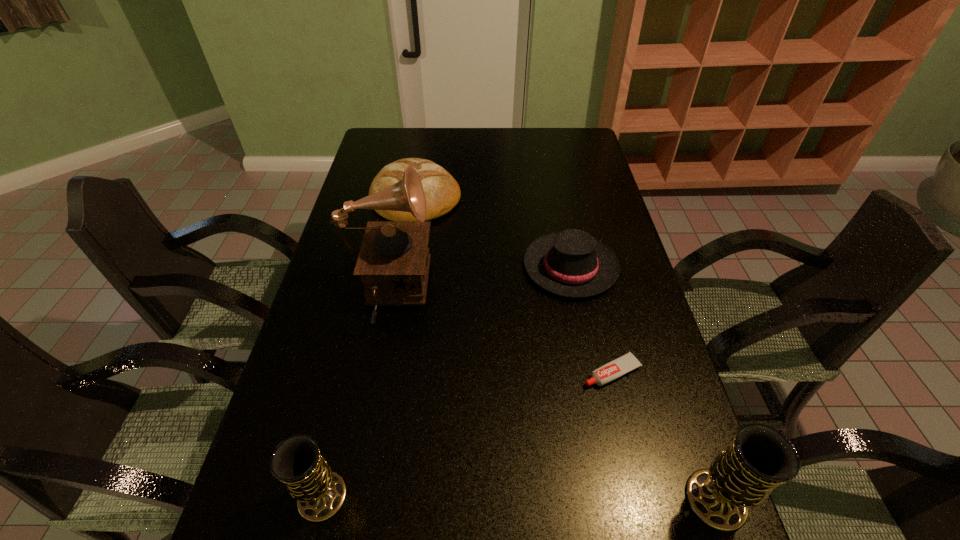
Image resolution: width=960 pixels, height=540 pixels. Identify the location of empty space that is in between the toothpaste and the taller chalice. (663, 436).

In order to click on unoccupied position between the third tallest object and the dress hat in this screenshot , I will do `click(446, 382)`.

Locate an element on the screen. free space between the dress hat and the shorter chalice is located at coordinates (446, 382).

The image size is (960, 540). I want to click on free spot between the taller chalice and the record player, so click(x=551, y=397).

At what (x,y) coordinates should I click in order to perform the action: click on empty space between the fourth farthest object and the bread. Please return your answer as a coordinate pair (x, y). Looking at the image, I should click on (514, 284).

Find the location of a particular element. This screenshot has height=540, width=960. free area in between the dress hat and the right chalice is located at coordinates [643, 383].

This screenshot has width=960, height=540. In order to click on object that is the second closest to the farthest object in this screenshot , I will do `click(571, 263)`.

I want to click on the closest object to the record player, so click(442, 192).

Where is `free location that satisfies the following two spatial constraints: 1. on the horn of the toothpaste; 2. on the right side of the record player`? This screenshot has width=960, height=540. free location that satisfies the following two spatial constraints: 1. on the horn of the toothpaste; 2. on the right side of the record player is located at coordinates (372, 372).

Identify the location of free location that satisfies the following two spatial constraints: 1. on the front side of the dress hat; 2. on the left side of the bread. Image resolution: width=960 pixels, height=540 pixels. (404, 267).